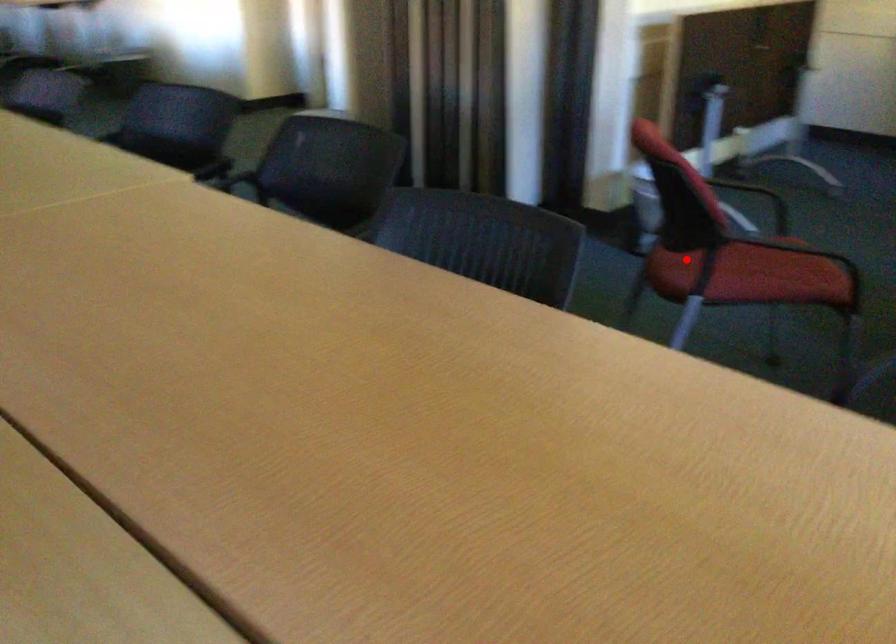
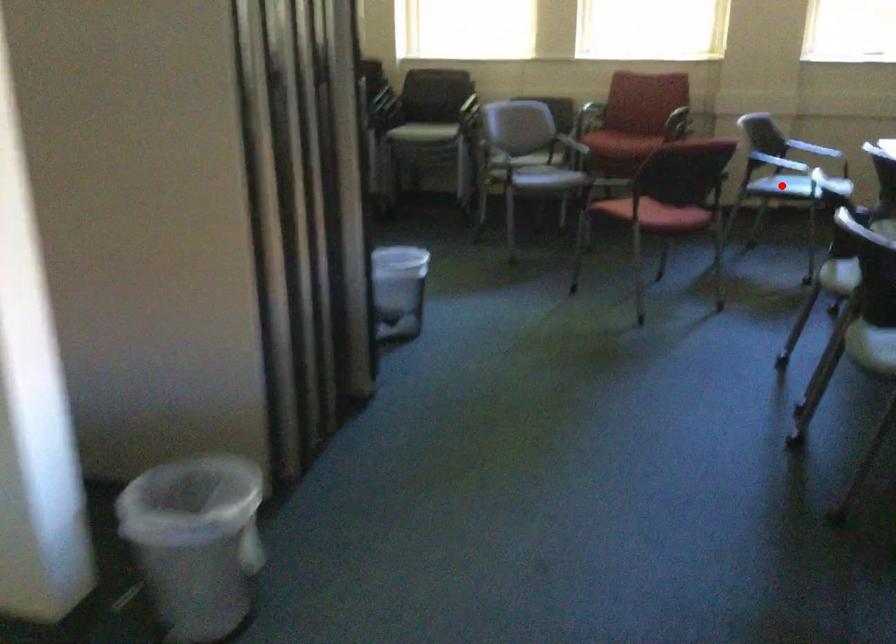
I am providing you with two images of the same scene from different viewpoints. A red point is marked on the first image and another point is marked on the second image. Is the red point in image1 aligned with the point shown in image2?

No